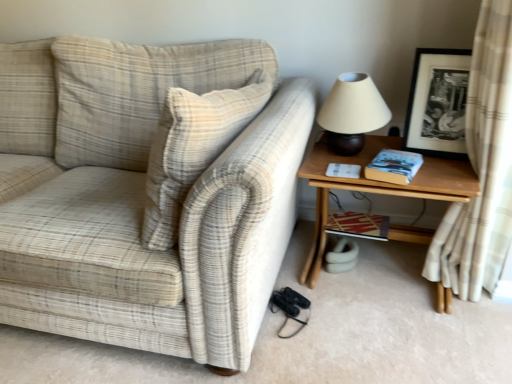
The height and width of the screenshot is (384, 512). I want to click on vacant area located to the right-hand side of hardcover book at right, which ranks as the 2th book in bottom-to-top order, so click(451, 170).